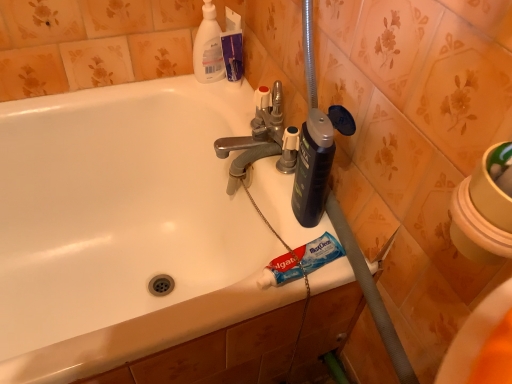
Question: Are polished chrome faucet at center and white plastic bottle at upper center far apart?

Choices:
 (A) yes
 (B) no

Answer: (B)

Question: Can you confirm if polished chrome faucet at center is smaller than white plastic bottle at upper center?

Choices:
 (A) yes
 (B) no

Answer: (B)

Question: Is polished chrome faucet at center turned away from white plastic bottle at upper center?

Choices:
 (A) yes
 (B) no

Answer: (B)

Question: Does polished chrome faucet at center appear on the right side of white plastic bottle at upper center?

Choices:
 (A) yes
 (B) no

Answer: (A)

Question: From the image's perspective, does polished chrome faucet at center appear higher than white plastic bottle at upper center?

Choices:
 (A) no
 (B) yes

Answer: (A)

Question: Does polished chrome faucet at center lie in front of white plastic bottle at upper center?

Choices:
 (A) no
 (B) yes

Answer: (B)

Question: Are polished chrome faucet at center and white glossy bathtub at center located far from each other?

Choices:
 (A) no
 (B) yes

Answer: (A)

Question: Does polished chrome faucet at center lie in front of white glossy bathtub at center?

Choices:
 (A) yes
 (B) no

Answer: (B)

Question: From a real-world perspective, is polished chrome faucet at center located beneath white glossy bathtub at center?

Choices:
 (A) yes
 (B) no

Answer: (B)

Question: Does polished chrome faucet at center appear on the left side of white glossy bathtub at center?

Choices:
 (A) no
 (B) yes

Answer: (A)

Question: Is polished chrome faucet at center next to white glossy bathtub at center?

Choices:
 (A) yes
 (B) no

Answer: (B)

Question: Considering the relative sizes of polished chrome faucet at center and white glossy bathtub at center in the image provided, is polished chrome faucet at center thinner than white glossy bathtub at center?

Choices:
 (A) yes
 (B) no

Answer: (A)

Question: Does white glossy bathtub at center lie behind polished chrome faucet at center?

Choices:
 (A) no
 (B) yes

Answer: (A)